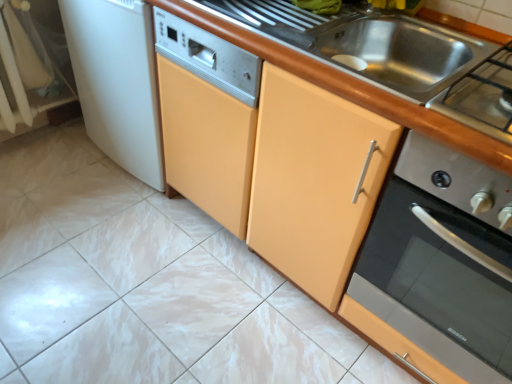
Question: In the image, is white glossy ceramic tile at center positioned in front of or behind stainless steel oven at right, the 2th home appliance when ordered from left to right?

Choices:
 (A) behind
 (B) front

Answer: (A)

Question: Is white glossy ceramic tile at center inside the boundaries of stainless steel oven at right, the 2th home appliance when ordered from left to right, or outside?

Choices:
 (A) inside
 (B) outside

Answer: (B)

Question: Estimate the real-world distances between objects in this image. Which object is closer to the wooden at center?

Choices:
 (A) stainless steel oven at right, the 2th home appliance when ordered from left to right
 (B) white glossy ceramic tile at center
 (C) white plastic dishwasher at center-left, which is the first home appliance from left to right
 (D) metallic stainless steel sink at upper center
 (E) stainless steel gas stove at upper right

Answer: (A)

Question: Which object is the closest to the stainless steel oven at right, the first home appliance viewed from the right?

Choices:
 (A) white glossy ceramic tile at center
 (B) white plastic dishwasher at center-left, arranged as the second home appliance when viewed from the right
 (C) stainless steel gas stove at upper right
 (D) wooden at center
 (E) metallic stainless steel sink at upper center

Answer: (D)